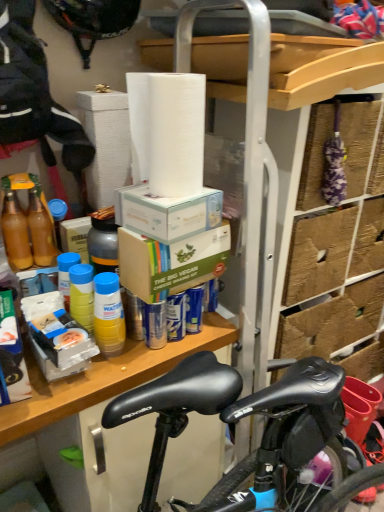
Question: From the image's perspective, is black matte helmet at upper left located above or below white cardboard box at upper center, which is the first box from top to bottom?

Choices:
 (A) above
 (B) below

Answer: (A)

Question: Looking at the image, does black matte helmet at upper left seem bigger or smaller compared to white cardboard box at upper center, which is the first box from top to bottom?

Choices:
 (A) big
 (B) small

Answer: (A)

Question: Which is farther from the translucent plastic bottle at shelf center, which appears as the first bottle when viewed from the left?

Choices:
 (A) wooden shelf at center
 (B) metallic silver bottle at center-left, which is the 2th bottle from right to left
 (C) white matte paper towel at upper center
 (D) white cardboard box at upper center, which is the first box from top to bottom
 (E) black matte helmet at upper left

Answer: (E)

Question: Estimate the real-world distances between objects in this image. Which object is closer to the yellow plastic bottle at lower left, which is counted as the 1th bottle, starting from the right?

Choices:
 (A) white cardboard box at upper center, which is the 2th box from bottom to top
 (B) brown cardboard box at center, which appears as the second box when viewed from the top
 (C) metallic silver bottle at center-left, which ranks as the 2th bottle in left-to-right order
 (D) translucent plastic bottle at shelf center, which is the third bottle from right to left
 (E) black matte helmet at upper left

Answer: (C)